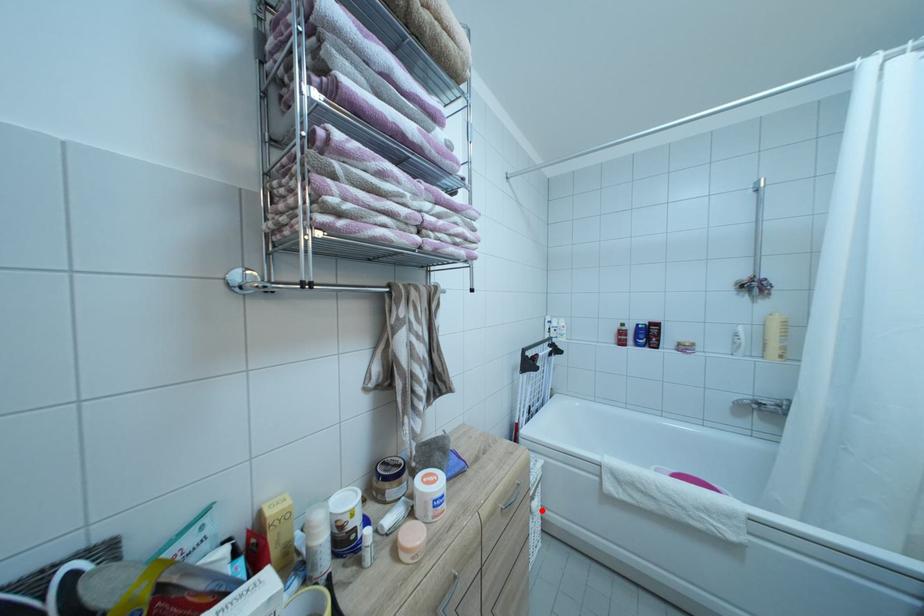
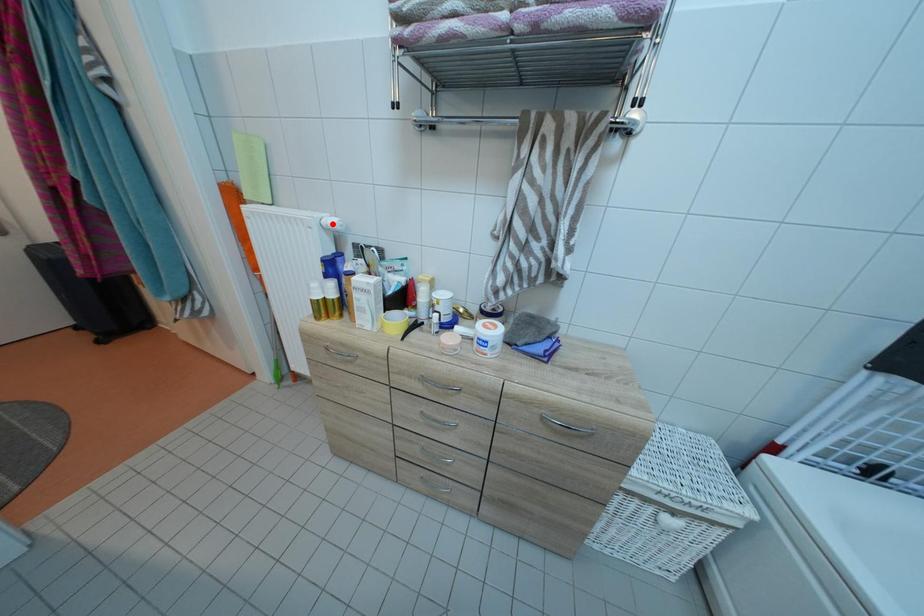
I am providing you with two images of the same scene from different viewpoints. A red point is marked on the first image and another point is marked on the second image. Do the highlighted points in image1 and image2 indicate the same real-world spot?

No